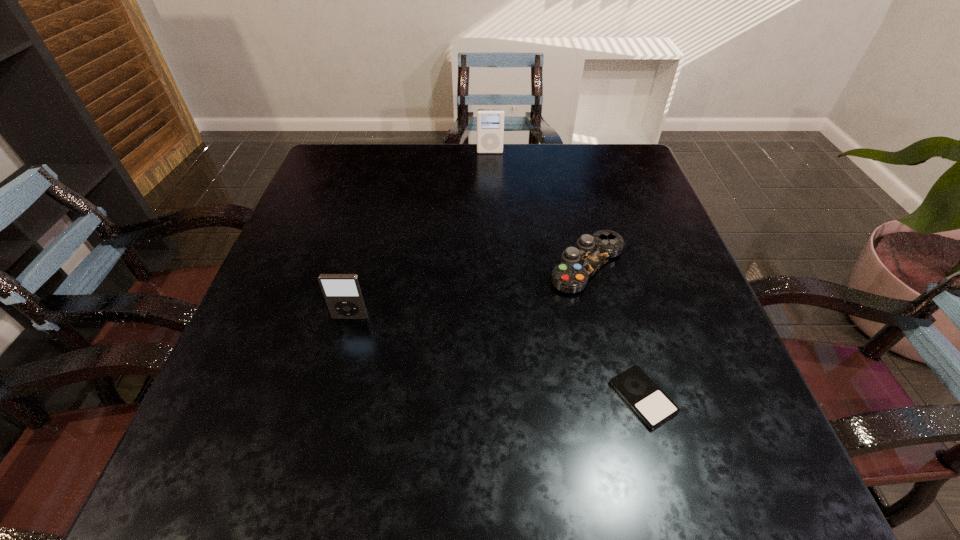
This screenshot has height=540, width=960. I want to click on vacant space located 0.120m on the back of the third tallest object, so [x=573, y=206].

Where is `free spot located 0.310m on the left of the shortest iPod`? This screenshot has height=540, width=960. free spot located 0.310m on the left of the shortest iPod is located at coordinates (422, 397).

Locate an element on the screen. This screenshot has width=960, height=540. object that is at the far edge is located at coordinates (490, 122).

Find the location of `object that is at the left edge`. object that is at the left edge is located at coordinates (342, 292).

Locate an element on the screen. The image size is (960, 540). control that is at the right edge is located at coordinates (577, 265).

Where is `iPod that is at the right edge`? iPod that is at the right edge is located at coordinates (650, 403).

Where is `vacant space at the far edge`? Image resolution: width=960 pixels, height=540 pixels. vacant space at the far edge is located at coordinates (390, 166).

The image size is (960, 540). I want to click on free region at the left edge of the desktop, so pyautogui.click(x=296, y=230).

In the image, there is a desktop. Find the location of `vacant space at the right edge`. vacant space at the right edge is located at coordinates (661, 271).

Locate an element on the screen. This screenshot has height=540, width=960. free space at the far left corner of the desktop is located at coordinates (353, 149).